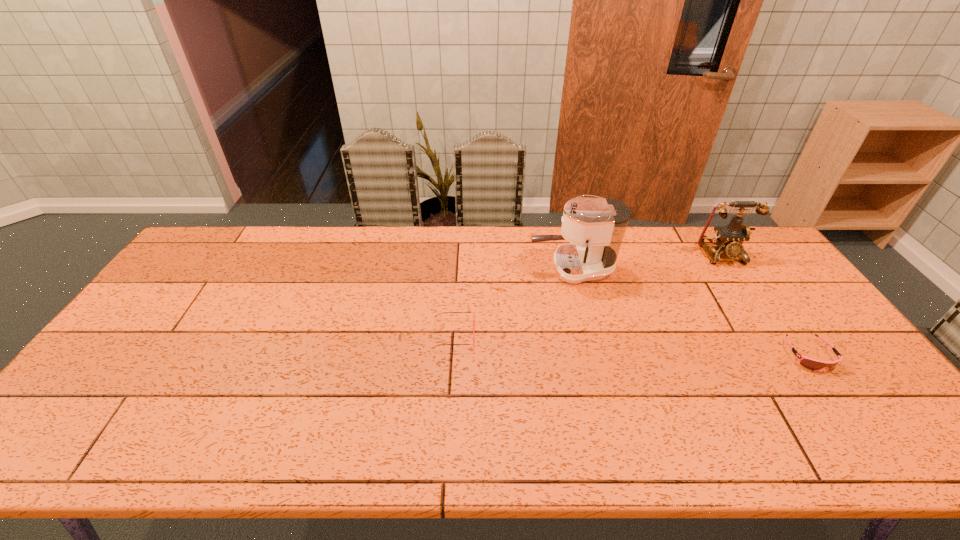
Choose which object is the nearest neighbor to the third shortest object. Please provide its 2D coordinates. Your answer should be formatted as a tuple, i.e. [(x, y)], where the tuple contains the x and y coordinates of a point satisfying the conditions above.

[(595, 227)]

This screenshot has width=960, height=540. In order to click on object that is the second nearest to the shortest object in this screenshot , I will do `click(595, 227)`.

In order to click on vacant region that satisfies the following two spatial constraints: 1. on the front of the telephone, featuring the rotary dial; 2. on the front-facing side of the leftmost object in this screenshot , I will do `click(774, 334)`.